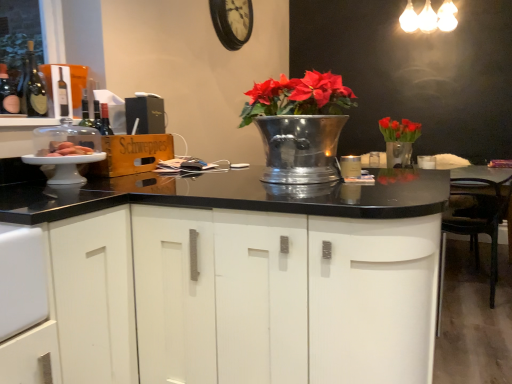
Question: Is black leather chair at right located within metallic silver vase at center?

Choices:
 (A) yes
 (B) no

Answer: (B)

Question: From the image's perspective, would you say metallic silver vase at center is shown under black leather chair at right?

Choices:
 (A) yes
 (B) no

Answer: (B)

Question: Does metallic silver vase at center turn towards black leather chair at right?

Choices:
 (A) no
 (B) yes

Answer: (A)

Question: Is metallic silver vase at center positioned far away from black leather chair at right?

Choices:
 (A) no
 (B) yes

Answer: (B)

Question: Does metallic silver vase at center have a greater height compared to black leather chair at right?

Choices:
 (A) no
 (B) yes

Answer: (A)

Question: Is matte white cake at left spatially inside wooden clock at upper center, or outside of it?

Choices:
 (A) inside
 (B) outside

Answer: (B)

Question: Looking at the image, does matte white cake at left seem bigger or smaller compared to wooden clock at upper center?

Choices:
 (A) big
 (B) small

Answer: (B)

Question: Is matte white cake at left taller or shorter than wooden clock at upper center?

Choices:
 (A) short
 (B) tall

Answer: (A)

Question: From the image's perspective, relative to wooden clock at upper center, is matte white cake at left above or below?

Choices:
 (A) above
 (B) below

Answer: (B)

Question: From the image's perspective, is metallic silver vase at center located above or below white matte cabinet at center?

Choices:
 (A) above
 (B) below

Answer: (A)

Question: Considering the relative positions of metallic silver vase at center and white matte cabinet at center in the image provided, is metallic silver vase at center to the left or to the right of white matte cabinet at center?

Choices:
 (A) right
 (B) left

Answer: (A)

Question: From a real-world perspective, is metallic silver vase at center above or below white matte cabinet at center?

Choices:
 (A) below
 (B) above

Answer: (B)

Question: Is metallic silver vase at center wider or thinner than white matte cabinet at center?

Choices:
 (A) wide
 (B) thin

Answer: (B)

Question: Do you think black leather chair at right is within wooden clock at upper center, or outside of it?

Choices:
 (A) inside
 (B) outside

Answer: (B)

Question: From the image's perspective, is black leather chair at right above or below wooden clock at upper center?

Choices:
 (A) below
 (B) above

Answer: (A)